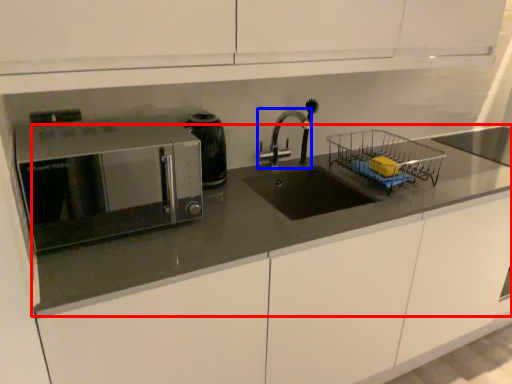
Question: Which object is further to the camera taking this photo, countertop (highlighted by a red box) or tap (highlighted by a blue box)?

Choices:
 (A) countertop
 (B) tap

Answer: (B)